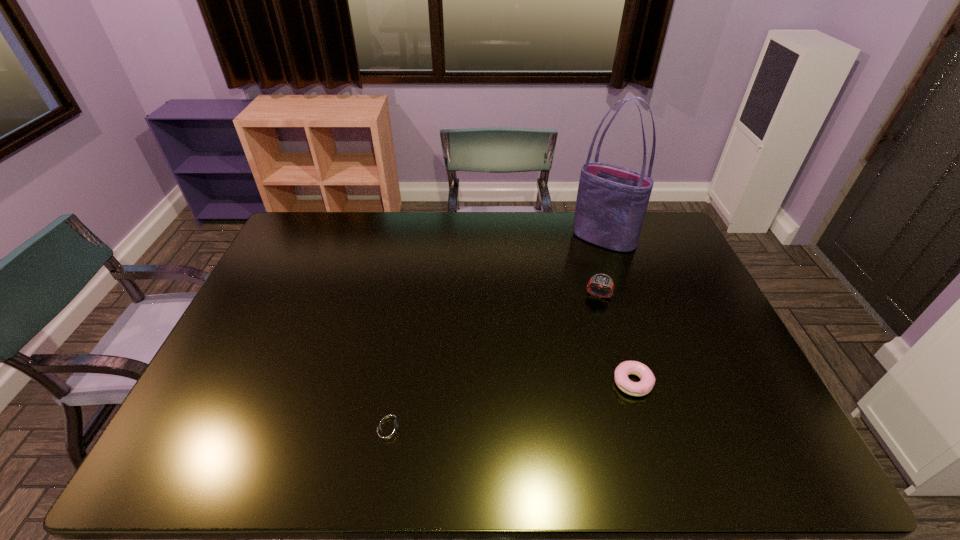
Where is `free space between the third farthest object and the taller watch`? The width and height of the screenshot is (960, 540). free space between the third farthest object and the taller watch is located at coordinates [x=615, y=339].

Identify the location of empty location between the tallest object and the third tallest object. (618, 310).

The image size is (960, 540). Identify the location of object that ranks as the closest to the third tallest object. (600, 281).

Select which object is the third closest to the shortest object. Please provide its 2D coordinates. Your answer should be formatted as a tuple, i.e. [(x, y)], where the tuple contains the x and y coordinates of a point satisfying the conditions above.

[(611, 204)]

Identify the location of vacant region that satisfies the following two spatial constraints: 1. on the front side of the farthest object; 2. on the face of the leftmost object. (668, 427).

At what (x,y) coordinates should I click in order to perform the action: click on free space that satisfies the following two spatial constraints: 1. on the back side of the third farthest object; 2. on the left side of the farthest object. Please return your answer as a coordinate pair (x, y). This screenshot has width=960, height=540. Looking at the image, I should click on (588, 239).

Image resolution: width=960 pixels, height=540 pixels. Find the location of `vacant area in the image that satisfies the following two spatial constraints: 1. on the front side of the second farthest object; 2. on the right side of the third tallest object`. vacant area in the image that satisfies the following two spatial constraints: 1. on the front side of the second farthest object; 2. on the right side of the third tallest object is located at coordinates (624, 382).